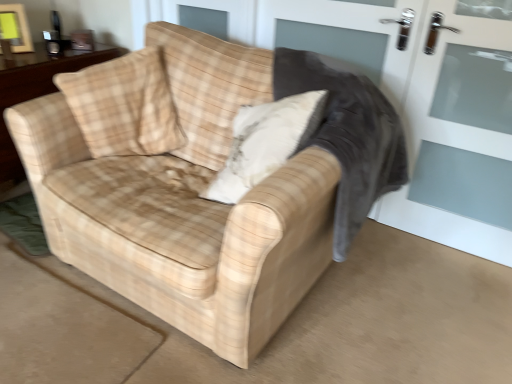
What do you see at coordinates (459, 132) in the screenshot? I see `white glass screen door at right` at bounding box center [459, 132].

Locate an element on the screen. beige plaid throw pillow at upper left, which ranks as the 1th throw pillow in left-to-right order is located at coordinates (124, 105).

Between plaid fabric rocking chair at center and beige plaid throw pillow at upper left, which ranks as the 1th throw pillow in left-to-right order, which one has larger width?

Wider between the two is beige plaid throw pillow at upper left, which ranks as the 1th throw pillow in left-to-right order.

Can you confirm if plaid fabric rocking chair at center is taller than beige plaid throw pillow at upper left, which ranks as the 1th throw pillow in left-to-right order?

Yes, plaid fabric rocking chair at center is taller than beige plaid throw pillow at upper left, which ranks as the 1th throw pillow in left-to-right order.

Based on the photo, how distant is plaid fabric rocking chair at center from beige plaid throw pillow at upper left, which ranks as the 1th throw pillow in left-to-right order?

They are 27.56 inches apart.

Locate an element on the screen. This screenshot has width=512, height=384. rocking chair behind the beige plaid throw pillow at upper left, acting as the 2th throw pillow starting from the right is located at coordinates (348, 135).

Considering the points (84, 85) and (15, 95), which point is in front, point (84, 85) or point (15, 95)?

The point (84, 85) is closer.

What's the angular difference between beige plaid throw pillow at upper left, which ranks as the 1th throw pillow in left-to-right order, and wooden table at center's facing directions?

They differ by 39.6 degrees in their facing directions.

Between beige plaid throw pillow at upper left, acting as the 2th throw pillow starting from the right, and wooden table at center, which one appears on the left side from the viewer's perspective?

wooden table at center.

Looking at this image, who is bigger, beige plaid throw pillow at upper left, which ranks as the 1th throw pillow in left-to-right order, or wooden table at center?

wooden table at center is bigger.

Is point (106, 211) closer to camera compared to point (158, 122)?

Yes.

Does beige plaid fabric couch at center have a lesser width compared to beige plaid throw pillow at upper left, acting as the 2th throw pillow starting from the right?

No, beige plaid fabric couch at center is not thinner than beige plaid throw pillow at upper left, acting as the 2th throw pillow starting from the right.

How much distance is there between beige plaid fabric couch at center and beige plaid throw pillow at upper left, which ranks as the 1th throw pillow in left-to-right order?

beige plaid fabric couch at center is 10.43 inches away from beige plaid throw pillow at upper left, which ranks as the 1th throw pillow in left-to-right order.

Which of these two, beige plaid fabric couch at center or beige plaid throw pillow at upper left, which ranks as the 1th throw pillow in left-to-right order, is smaller?

With smaller size is beige plaid throw pillow at upper left, which ranks as the 1th throw pillow in left-to-right order.

Considering the positions of point (175, 131) and point (37, 63), is point (175, 131) closer or farther from the camera than point (37, 63)?

Point (175, 131) is positioned closer to the camera compared to point (37, 63).

Is beige plaid fabric couch at center behind wooden table at center?

No, beige plaid fabric couch at center is closer to the viewer.

Could you tell me if beige plaid fabric couch at center is turned towards wooden table at center?

No, beige plaid fabric couch at center is not turned towards wooden table at center.

Considering the sizes of objects plaid fabric rocking chair at center and beige plaid throw pillow at center, placed as the 1th throw pillow when sorted from right to left, in the image provided, who is thinner, plaid fabric rocking chair at center or beige plaid throw pillow at center, placed as the 1th throw pillow when sorted from right to left,?

Thinner between the two is plaid fabric rocking chair at center.

From the plaid fabric rocking chair at center, count 2nd throw pillows forward and point to it. Please provide its 2D coordinates.

[(265, 142)]

In terms of height, does plaid fabric rocking chair at center look taller or shorter compared to beige plaid throw pillow at center, which is counted as the second throw pillow, starting from the left?

plaid fabric rocking chair at center is taller than beige plaid throw pillow at center, which is counted as the second throw pillow, starting from the left.

Is beige plaid fabric couch at center shorter than white glass screen door at right?

Indeed, beige plaid fabric couch at center has a lesser height compared to white glass screen door at right.

Considering the sizes of beige plaid fabric couch at center and white glass screen door at right in the image, is beige plaid fabric couch at center wider or thinner than white glass screen door at right?

beige plaid fabric couch at center is wider than white glass screen door at right.

Is beige plaid fabric couch at center positioned beyond the bounds of white glass screen door at right?

Absolutely, beige plaid fabric couch at center is external to white glass screen door at right.

Considering the positions of objects beige plaid fabric couch at center and white glass screen door at right in the image provided, who is more to the right, beige plaid fabric couch at center or white glass screen door at right?

white glass screen door at right is more to the right.

Identify the location of studio couch that appears above the wooden table at center (from a real-world perspective). (182, 199).

Between wooden table at center and beige plaid fabric couch at center, which one appears on the left side from the viewer's perspective?

wooden table at center is more to the left.

Is wooden table at center not within beige plaid fabric couch at center?

Yes, wooden table at center is located beyond the bounds of beige plaid fabric couch at center.

Is wooden table at center beside beige plaid fabric couch at center?

No, wooden table at center is not beside beige plaid fabric couch at center.

From a real-world perspective, starting from the plaid fabric rocking chair at center, which throw pillow is the 2nd one vertically above it? Please provide its 2D coordinates.

[(124, 105)]

In order to click on table on the left of the beige plaid throw pillow at upper left, acting as the 2th throw pillow starting from the right in this screenshot , I will do `click(37, 90)`.

From the image, which object appears to be farther from beige plaid throw pillow at upper left, which ranks as the 1th throw pillow in left-to-right order, plaid fabric rocking chair at center or wooden table at center?

The object further to beige plaid throw pillow at upper left, which ranks as the 1th throw pillow in left-to-right order, is plaid fabric rocking chair at center.

Which object lies nearer to the anchor point plaid fabric rocking chair at center, beige plaid fabric couch at center or wooden table at center?

Among the two, beige plaid fabric couch at center is located nearer to plaid fabric rocking chair at center.

Estimate the real-world distances between objects in this image. Which object is closer to beige plaid throw pillow at upper left, acting as the 2th throw pillow starting from the right, white glass screen door at right or beige plaid throw pillow at center, which is counted as the second throw pillow, starting from the left?

beige plaid throw pillow at center, which is counted as the second throw pillow, starting from the left, lies closer to beige plaid throw pillow at upper left, acting as the 2th throw pillow starting from the right, than the other object.

Estimate the real-world distances between objects in this image. Which object is further from beige plaid fabric couch at center, beige plaid throw pillow at center, which is counted as the second throw pillow, starting from the left, or wooden table at center?

The object further to beige plaid fabric couch at center is wooden table at center.

In the scene shown: Looking at the image, which one is located closer to plaid fabric rocking chair at center, wooden table at center or white glass screen door at right?

The object closer to plaid fabric rocking chair at center is white glass screen door at right.

Estimate the real-world distances between objects in this image. Which object is closer to wooden table at center, white glass screen door at right or beige plaid fabric couch at center?

beige plaid fabric couch at center lies closer to wooden table at center than the other object.

Based on their spatial positions, is beige plaid throw pillow at center, placed as the 1th throw pillow when sorted from right to left, or beige plaid throw pillow at upper left, which ranks as the 1th throw pillow in left-to-right order, closer to wooden table at center?

beige plaid throw pillow at upper left, which ranks as the 1th throw pillow in left-to-right order, is closer to wooden table at center.

Which object lies further to the anchor point plaid fabric rocking chair at center, beige plaid fabric couch at center or beige plaid throw pillow at upper left, which ranks as the 1th throw pillow in left-to-right order?

beige plaid throw pillow at upper left, which ranks as the 1th throw pillow in left-to-right order, is further to plaid fabric rocking chair at center.

Locate an element on the screen. Image resolution: width=512 pixels, height=384 pixels. rocking chair between beige plaid fabric couch at center and white glass screen door at right from left to right is located at coordinates (348, 135).

You are a GUI agent. You are given a task and a screenshot of the screen. Output one action in this format:
    pyautogui.click(x=<x>, y=<y>)
    Task: Click on the throw pillow between beige plaid throw pillow at upper left, which ranks as the 1th throw pillow in left-to-right order, and plaid fabric rocking chair at center from left to right
    The image size is (512, 384).
    Given the screenshot: What is the action you would take?
    pyautogui.click(x=265, y=142)

What are the coordinates of `throw pillow between wooden table at center and beige plaid throw pillow at center, which is counted as the second throw pillow, starting from the left` in the screenshot? It's located at (124, 105).

Where is `throw pillow between beige plaid throw pillow at upper left, acting as the 2th throw pillow starting from the right, and white glass screen door at right`? The image size is (512, 384). throw pillow between beige plaid throw pillow at upper left, acting as the 2th throw pillow starting from the right, and white glass screen door at right is located at coordinates (265, 142).